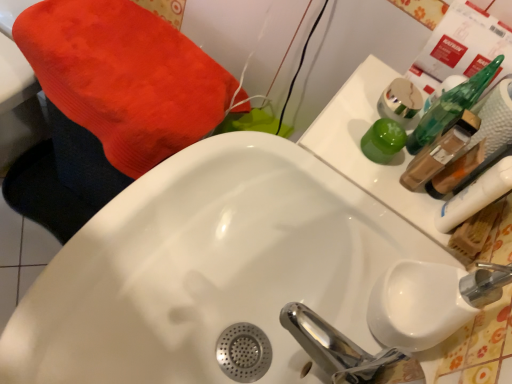
Locate an element on the screen. This screenshot has height=384, width=512. vacant area that is in front of translucent plastic mouthwash at upper right, which is the 3th mouthwash in top-to-bottom order is located at coordinates (391, 240).